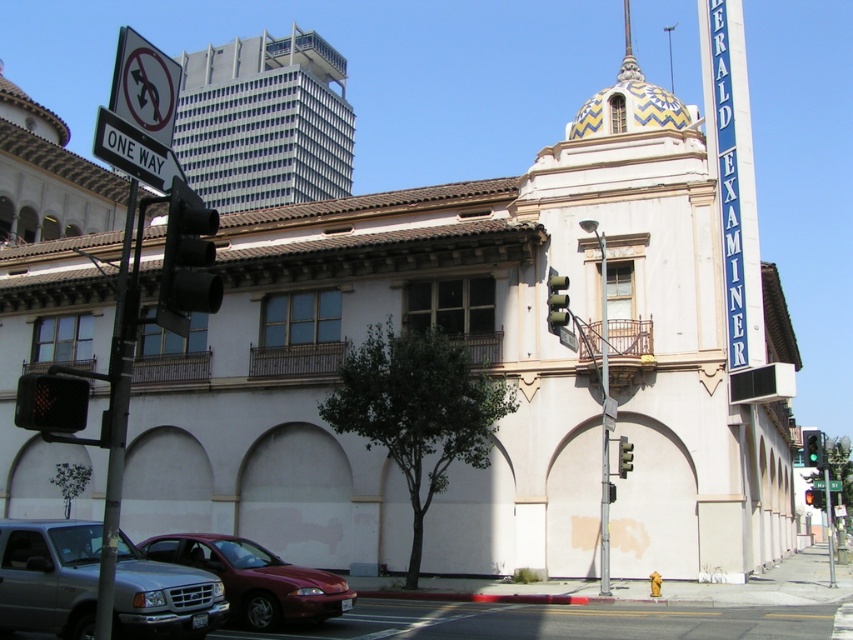
Question: Which of the following is the farthest from the observer?

Choices:
 (A) black plastic pedestrian signal at lower left
 (B) green glass traffic light at upper right
 (C) green metallic street sign at upper center

Answer: (B)

Question: Is silver metallic truck at lower left further to camera compared to metallic red sedan at lower left?

Choices:
 (A) yes
 (B) no

Answer: (B)

Question: Considering the relative positions of black plastic traffic light at left and green glass traffic light at right in the image provided, where is black plastic traffic light at left located with respect to green glass traffic light at right?

Choices:
 (A) left
 (B) right

Answer: (A)

Question: Estimate the real-world distances between objects in this image. Which object is farther from the silver metallic truck at lower left?

Choices:
 (A) white plastic sign at upper left
 (B) gray concrete skyscraper at upper center
 (C) green glass traffic light at upper right
 (D) white plastic street sign at upper left

Answer: (B)

Question: Considering the real-world distances, which object is farthest from the green glass traffic light at right?

Choices:
 (A) black plastic pedestrian signal at lower left
 (B) silver metallic truck at lower left

Answer: (B)

Question: Where is green glass traffic light at right located in relation to green metallic street sign at upper center in the image?

Choices:
 (A) below
 (B) above

Answer: (B)